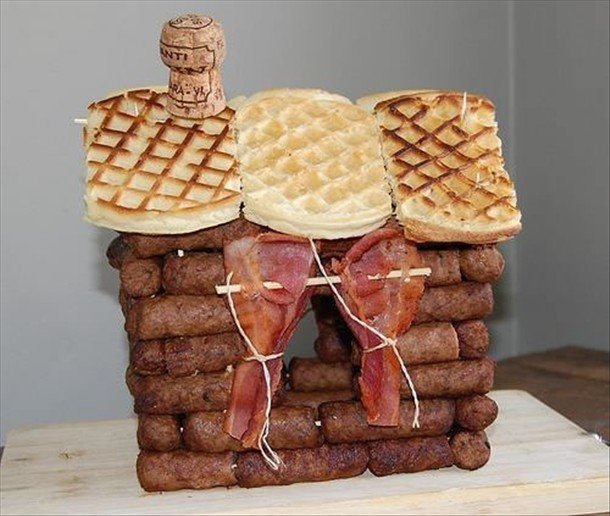
Where is `house window`? This screenshot has width=610, height=516. house window is located at coordinates (305, 340).